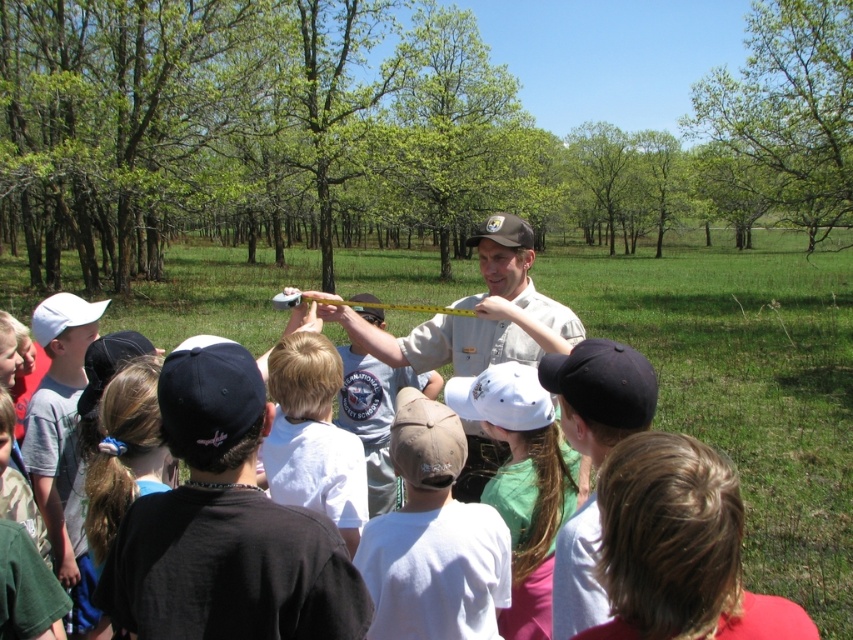
Question: Does white cotton shirt at center appear on the left side of light brown cotton shirt at center?

Choices:
 (A) yes
 (B) no

Answer: (B)

Question: In this image, where is green cotton shirt at center located relative to brown fabric baseball cap at center?

Choices:
 (A) right
 (B) left

Answer: (A)

Question: Can you confirm if white matte baseball cap at center is positioned below matte brown baseball cap at center?

Choices:
 (A) no
 (B) yes

Answer: (B)

Question: Estimate the real-world distances between objects in this image. Which object is farther from the khaki uniform at center?

Choices:
 (A) light brown cotton shirt at center
 (B) white matte baseball cap at left

Answer: (B)

Question: Considering the real-world distances, which object is farthest from the khaki uniform at center?

Choices:
 (A) green cotton shirt at center
 (B) light brown cotton shirt at center
 (C) white matte baseball cap at left

Answer: (C)

Question: Which object is the closest to the khaki uniform at center?

Choices:
 (A) matte brown baseball cap at center
 (B) white cotton shirt at center
 (C) light brown cotton shirt at center

Answer: (C)